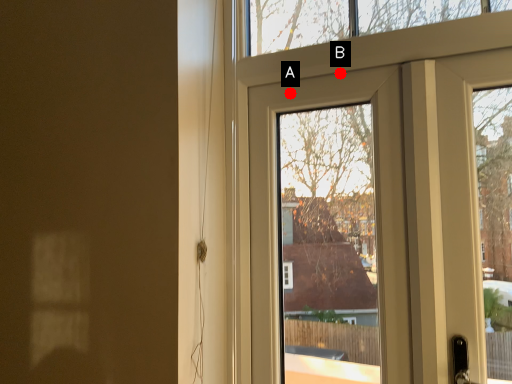
Question: Two points are circled on the image, labeled by A and B beside each circle. Which point appears closest to the camera in this image?

Choices:
 (A) A is closer
 (B) B is closer

Answer: (B)